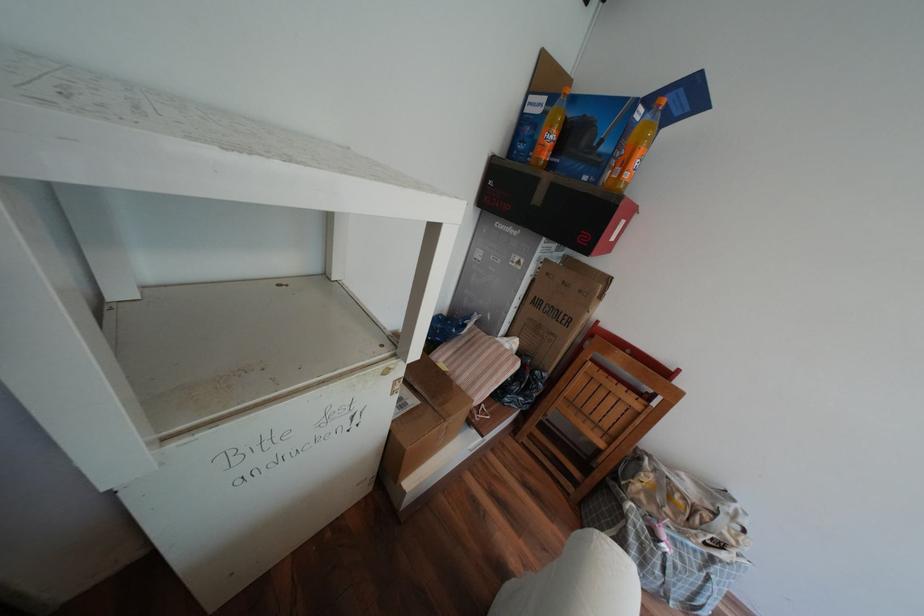
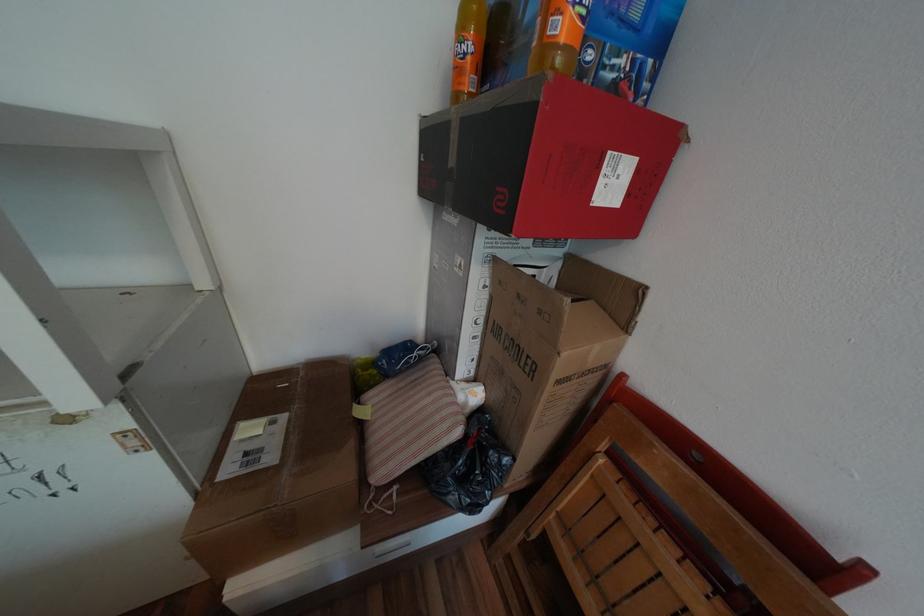
Locate, in the second image, the point that corresponds to pixel 637 176 in the first image.

(569, 26)